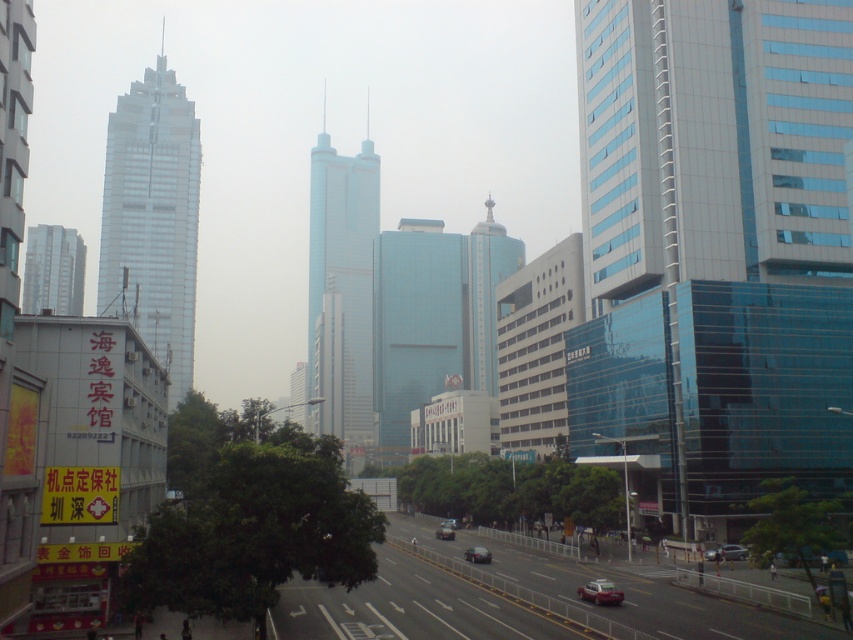
You are a drone operator trying to fly a drone between the metallic blue tower at center and another building. The drone has a maximum flight distance of 500 feet. Can you safely fly the drone between them without exceeding its range?

The metallic blue tower at center and another building are 527.27 feet apart. Since the drone has a maximum flight distance of 500 feet, it cannot safely fly between them without exceeding its range.

You are a pedestrian standing at the crosswalk near the metallic red car at lower right and the shiny black sedan at center. The crosswalk is 50 feet long. Can you safely cross the road before the cars reach you?

The metallic red car at lower right and shiny black sedan at center are 49.90 feet apart, so the distance between them is less than the 50 feet crosswalk. Therefore, you should wait until the cars pass before crossing safely.

You are a pedestrian standing on the sidewalk and looking straight ahead. You see the metallic blue tower at center and the shiny silver car at center. Which object is higher from the ground?

The metallic blue tower at center is positioned over the shiny silver car at center, so the metallic blue tower at center is higher from the ground.